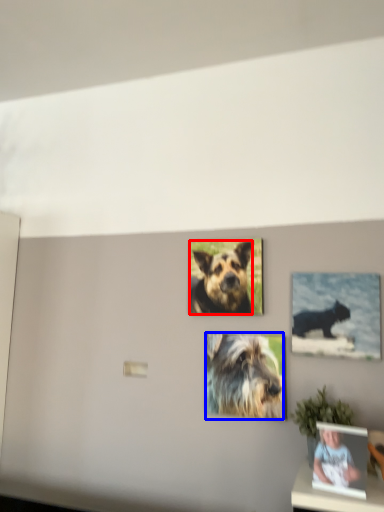
Question: Which of the following is the closest to the observer, dog (highlighted by a red box) or dog (highlighted by a blue box)?

Choices:
 (A) dog
 (B) dog

Answer: (B)